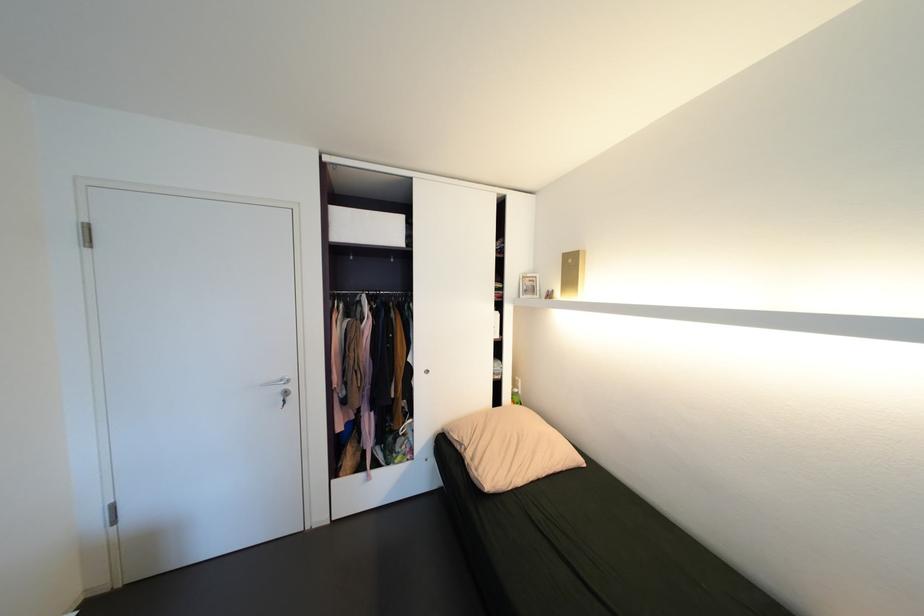
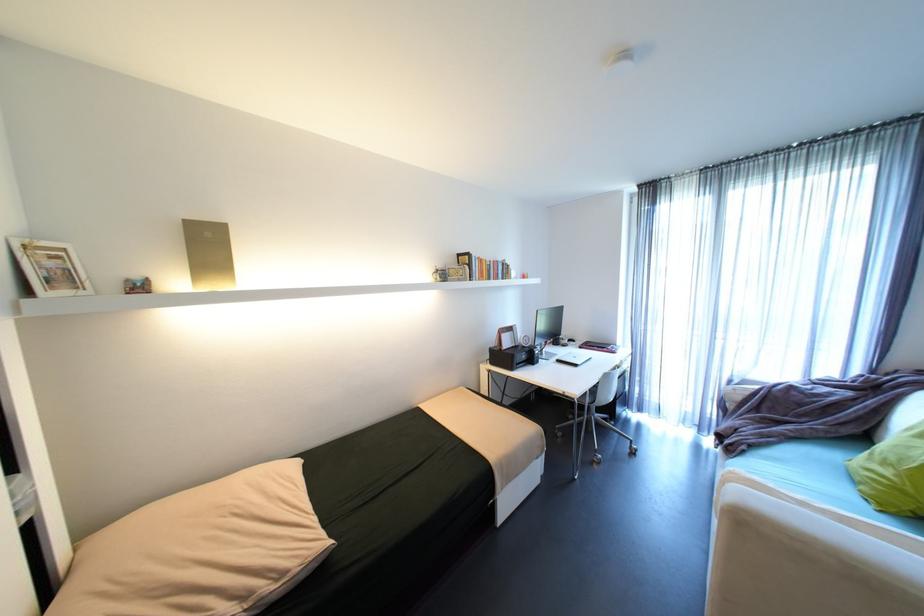
Locate, in the second image, the point that corresponds to (483,469) in the first image.

(289, 575)